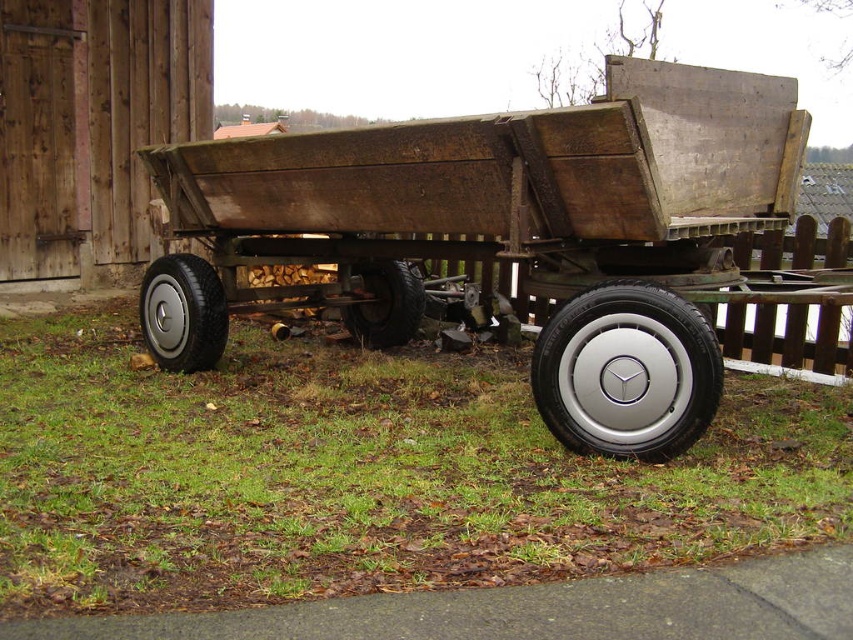
In the scene shown: You are standing in front of the vintage wooden trailer and want to place two markers at the coordinates point (561, 548) and point (642, 369). Which marker will be closer to your position?

Point (561, 548) is closer to the viewer than point (642, 369), so the marker at point (561, 548) will be closer to your position.

You are a gardener planning to mow the lawn around the silver metallic wheel at center. Given that your lawnmower can only handle areas wider than the wheel, will the green grass at lower center be suitable for mowing with your equipment?

The green grass at lower center has a width larger than the silver metallic wheel at center, so yes, the area is suitable for mowing with your lawnmower since it meets the width requirement.